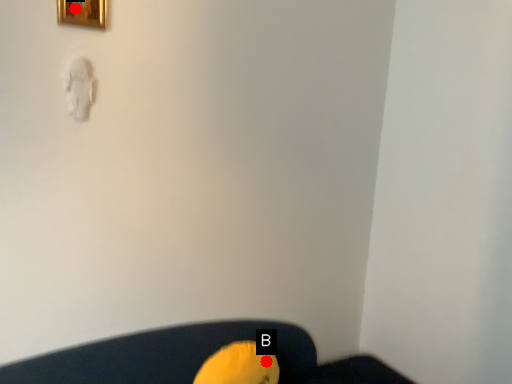
Question: Two points are circled on the image, labeled by A and B beside each circle. Among these points, which one is nearest to the camera?

Choices:
 (A) A is closer
 (B) B is closer

Answer: (A)